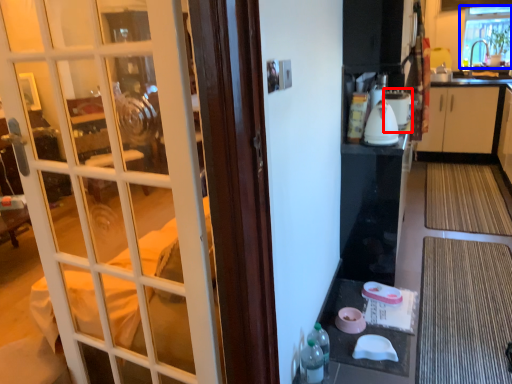
Question: Among these objects, which one is nearest to the camera, appliance (highlighted by a red box) or window (highlighted by a blue box)?

Choices:
 (A) appliance
 (B) window

Answer: (A)